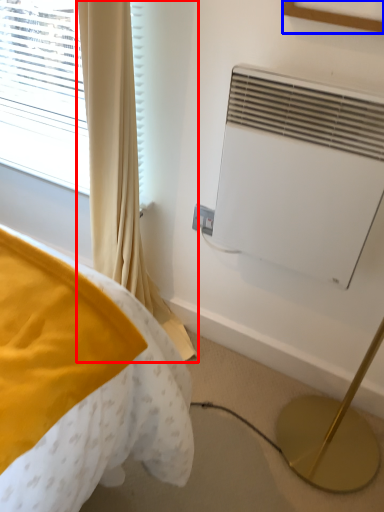
Question: Which object is further to the camera taking this photo, curtain (highlighted by a red box) or picture frame (highlighted by a blue box)?

Choices:
 (A) curtain
 (B) picture frame

Answer: (A)